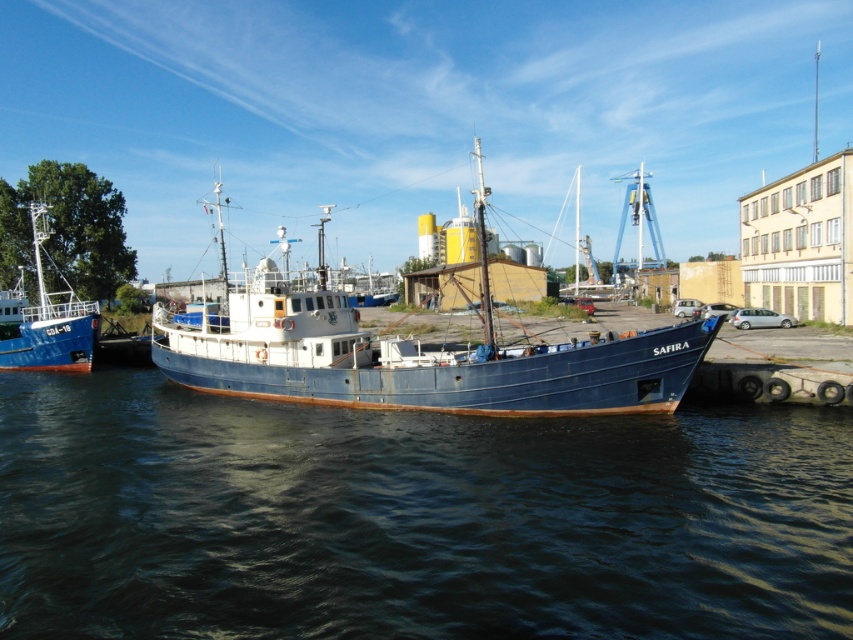
You are a delivery drone operator who needs to land your drone on a platform near the rusty metal boat at center. The platform is at point coordinates of (x=416, y=355). Can you confirm if the platform is exactly where the rusty metal boat at center is located?

The rusty metal boat at center is located at point coordinates (x=416, y=355), so yes, the platform is exactly where the rusty metal boat at center is located.

You are standing at the dock looking at the SAFIRA boat. There are two points marked on the boat. The first point is at coordinate point [718,515] and the second is at point [86,349]. Which of these two points is closer to you?

Point [718,515] is closer to the viewer than point [86,349].

You are standing on the dock next to the brushed metal boat at left and want to get to the dark blue water at center. Which direction should you move in?

You should move to the right to reach the dark blue water at center since it is located to the right of the brushed metal boat at left.